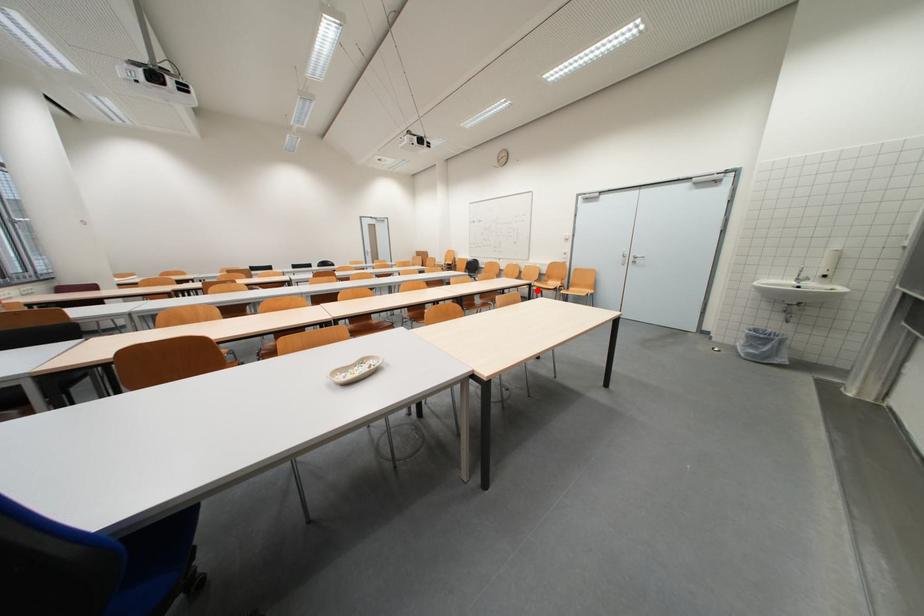
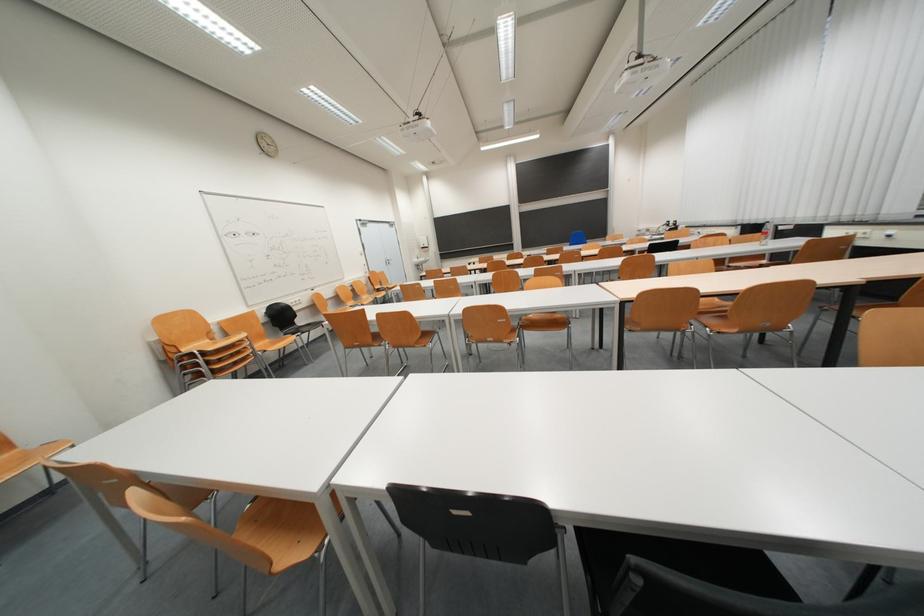
Question: I am providing you with two images of the same scene from different viewpoints. A red point is marked on the first image. Is the red point's position out of view in image 2?

Choices:
 (A) Yes
 (B) No

Answer: (A)